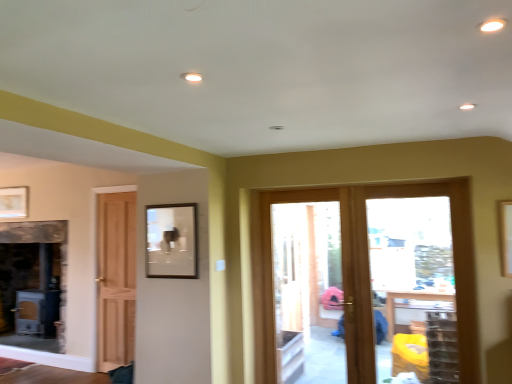
Question: Is clear glass door at center far from wooden door at center?

Choices:
 (A) yes
 (B) no

Answer: (B)

Question: Does clear glass door at center appear on the left side of wooden door at center?

Choices:
 (A) yes
 (B) no

Answer: (B)

Question: Is clear glass door at center with wooden door at center?

Choices:
 (A) yes
 (B) no

Answer: (B)

Question: Is wooden door at center located within clear glass door at center?

Choices:
 (A) no
 (B) yes

Answer: (A)

Question: From the image's perspective, is clear glass door at center located beneath wooden door at center?

Choices:
 (A) no
 (B) yes

Answer: (A)

Question: Considering the relative positions of wooden door at center and clear glass door at center in the image provided, is wooden door at center to the left or to the right of clear glass door at center?

Choices:
 (A) left
 (B) right

Answer: (B)

Question: Is wooden door at center inside the boundaries of clear glass door at center, or outside?

Choices:
 (A) inside
 (B) outside

Answer: (A)

Question: From the image's perspective, is wooden door at center positioned above or below clear glass door at center?

Choices:
 (A) above
 (B) below

Answer: (A)

Question: From a real-world perspective, relative to clear glass door at center, is wooden door at center vertically above or below?

Choices:
 (A) above
 (B) below

Answer: (A)

Question: From the image's perspective, is clear glass door at center positioned above or below wooden door at center?

Choices:
 (A) above
 (B) below

Answer: (B)

Question: In the image, is clear glass door at center on the left side or the right side of wooden door at center?

Choices:
 (A) left
 (B) right

Answer: (A)

Question: Relative to wooden door at center, is clear glass door at center in front or behind?

Choices:
 (A) front
 (B) behind

Answer: (B)

Question: From a real-world perspective, is clear glass door at center above or below wooden door at center?

Choices:
 (A) below
 (B) above

Answer: (A)

Question: From a real-world perspective, relative to clear glass door at center, is matte gold picture frame at upper left, the second picture frame positioned from the right, vertically above or below?

Choices:
 (A) below
 (B) above

Answer: (B)

Question: Is matte gold picture frame at upper left, the second picture frame viewed from the front, wider or thinner than clear glass door at center?

Choices:
 (A) thin
 (B) wide

Answer: (A)